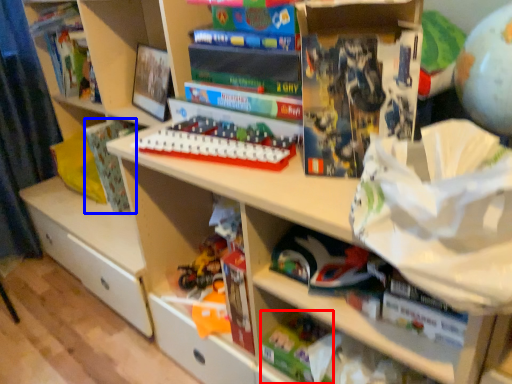
Question: Which of the following is the farthest to the observer, toy (highlighted by a red box) or paperback book (highlighted by a blue box)?

Choices:
 (A) toy
 (B) paperback book

Answer: (B)